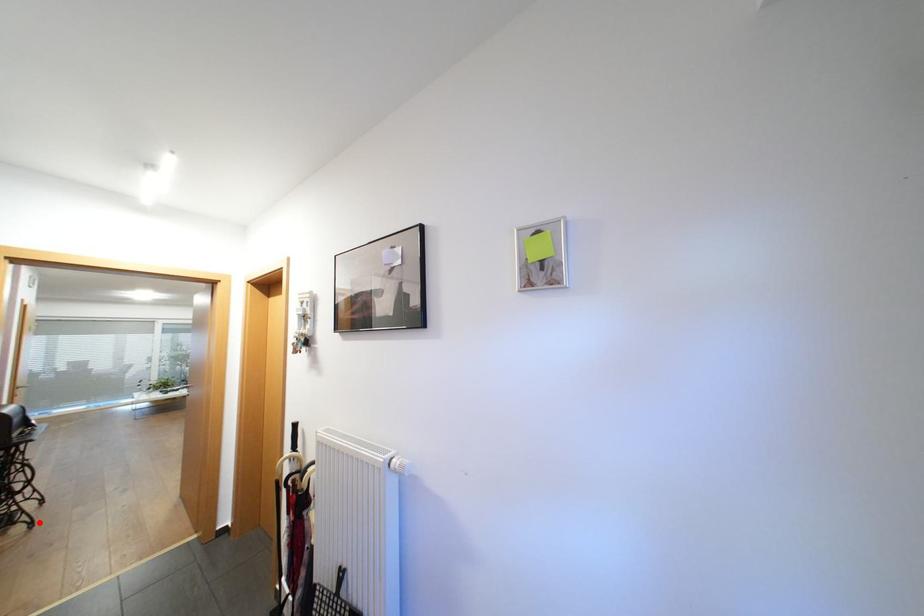
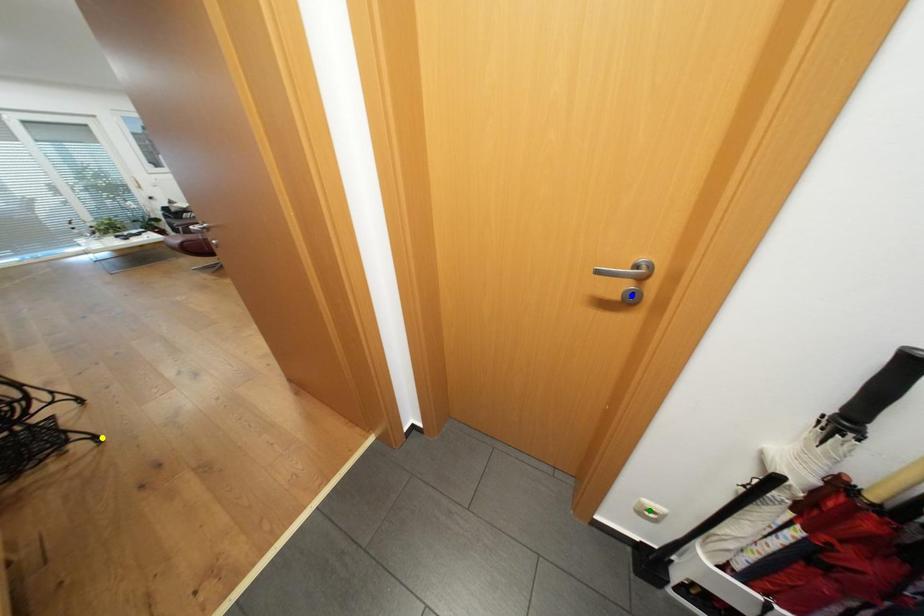
Question: I am providing you with two images of the same scene from different viewpoints. A red point is marked on the first image. You are given multiple points on the second image. Which point in image 2 is actually the same real-world point as the red point in image 1?

Choices:
 (A) blue point
 (B) green point
 (C) yellow point

Answer: (C)